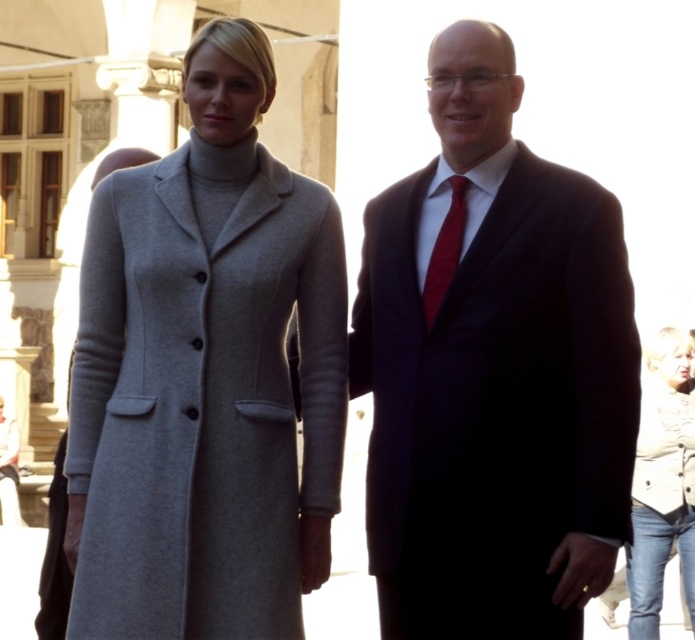
Question: Which object appears farthest from the camera in this image?

Choices:
 (A) matte black suit at center
 (B) denim jacket at lower right
 (C) matte gray coat at center

Answer: (C)

Question: Is red silk tie at center bigger than matte gray coat at center?

Choices:
 (A) yes
 (B) no

Answer: (B)

Question: Is matte black suit at center behind denim jacket at lower right?

Choices:
 (A) no
 (B) yes

Answer: (A)

Question: Estimate the real-world distances between objects in this image. Which object is farther from the matte gray coat at center?

Choices:
 (A) denim jacket at lower right
 (B) gray wool coat at left
 (C) matte black suit at center

Answer: (C)

Question: Among these objects, which one is farthest from the camera?

Choices:
 (A) gray wool coat at left
 (B) matte black suit at center

Answer: (A)

Question: Is matte black suit at center positioned at the back of red silk tie at center?

Choices:
 (A) yes
 (B) no

Answer: (B)